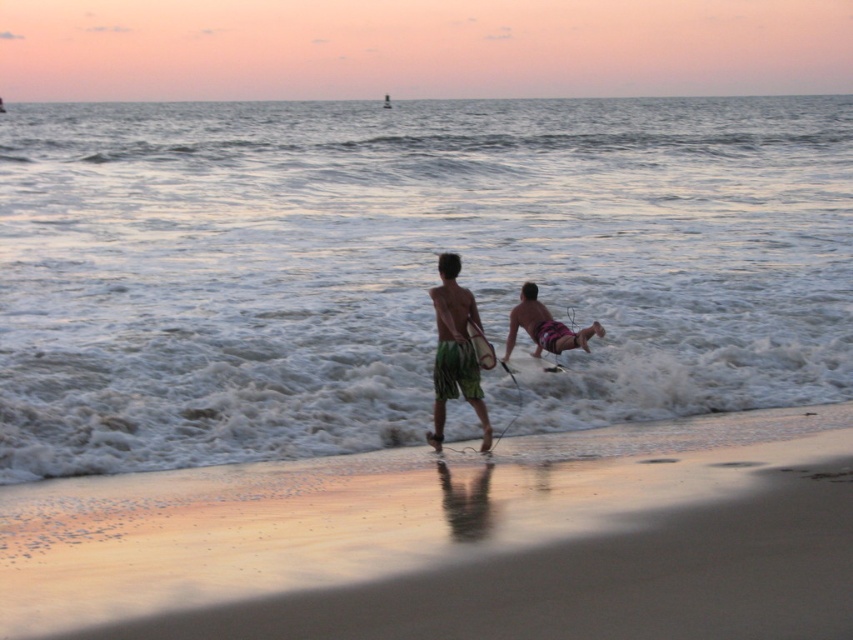
Question: Observing the image, what is the correct spatial positioning of clear water at center in reference to smooth brown surfboard at center?

Choices:
 (A) left
 (B) right

Answer: (B)

Question: Can you confirm if pink fabric surfboard at center is positioned to the left of white foam surfboard at right?

Choices:
 (A) yes
 (B) no

Answer: (B)

Question: Which point is farther from the camera taking this photo?

Choices:
 (A) (578, 342)
 (B) (469, 604)
 (C) (463, 296)
 (D) (489, 358)

Answer: (A)

Question: Considering the real-world distances, which object is closest to the pink fabric surfboard at center?

Choices:
 (A) sandy beach at lower center
 (B) green textured shorts at center
 (C) white foam surfboard at right

Answer: (C)

Question: In this image, where is clear water at center located relative to green textured shorts at center?

Choices:
 (A) below
 (B) above

Answer: (B)

Question: Which point appears farthest from the camera in this image?

Choices:
 (A) (556, 369)
 (B) (378, 513)
 (C) (448, 314)
 (D) (639, 353)

Answer: (D)